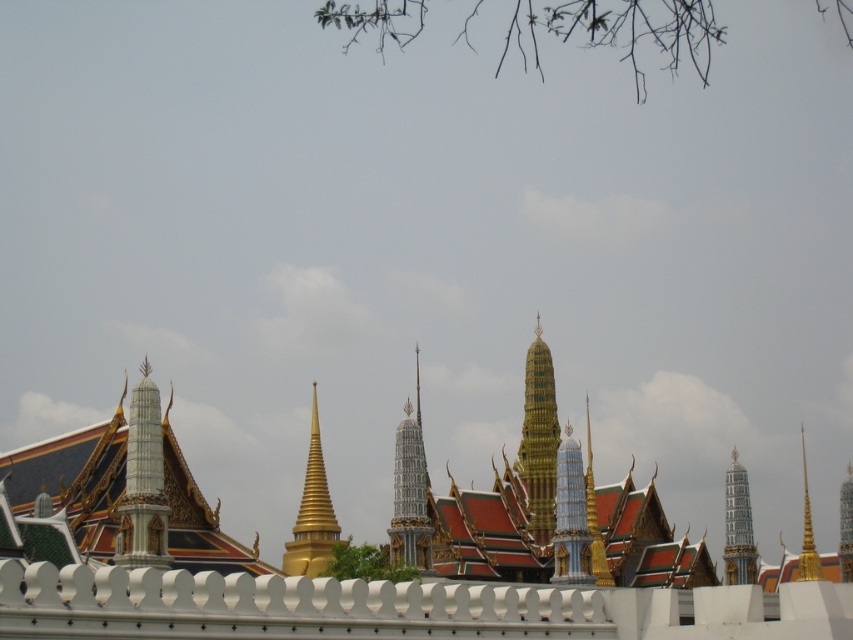
Does point (387, 547) lie behind point (590, 493)?

No, it is in front of (590, 493).

Between white glossy spire at center and gold metallic spire at center-right, which one is positioned higher?

white glossy spire at center is higher up.

Image resolution: width=853 pixels, height=640 pixels. What do you see at coordinates (410, 493) in the screenshot?
I see `white glossy spire at center` at bounding box center [410, 493].

Locate an element on the screen. white glossy spire at center is located at coordinates (410, 493).

What do you see at coordinates (393, 608) in the screenshot?
I see `white matte fence at lower center` at bounding box center [393, 608].

Is white matte fence at lower center below gold polished spire at center?

Yes.

Where is `white matte fence at lower center`? This screenshot has height=640, width=853. white matte fence at lower center is located at coordinates (393, 608).

Does gold/golden/temple spire at center have a lesser width compared to gold metallic spire at center-right?

Correct, gold/golden/temple spire at center's width is less than gold metallic spire at center-right's.

Based on the photo, who is more distant from viewer, (527, 436) or (590, 518)?

The point (527, 436) is behind.

Identify the location of gold/golden/temple spire at center. Image resolution: width=853 pixels, height=640 pixels. (538, 440).